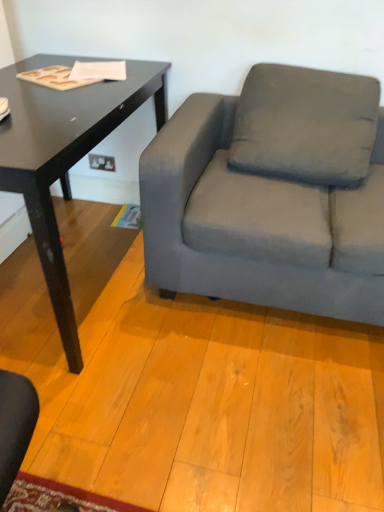
Locate an element on the screen. The height and width of the screenshot is (512, 384). gray fabric couch at right is located at coordinates (272, 195).

Image resolution: width=384 pixels, height=512 pixels. Describe the element at coordinates (64, 156) in the screenshot. I see `black glossy table at left` at that location.

Locate an element on the screen. The height and width of the screenshot is (512, 384). gray fabric couch at right is located at coordinates (272, 195).

You are a GUI agent. You are given a task and a screenshot of the screen. Output one action in this format:
    pyautogui.click(x=<x>, y=<y>)
    Task: Click on the table below the gray fabric pillow at center (from the image's perspective)
    Image resolution: width=384 pixels, height=512 pixels.
    Given the screenshot: What is the action you would take?
    pyautogui.click(x=64, y=156)

From the image's perspective, would you say gray fabric pillow at center is positioned over black glossy table at left?

Indeed, from the image's perspective, gray fabric pillow at center is shown above black glossy table at left.

Are gray fabric pillow at center and black glossy table at left beside each other?

No, gray fabric pillow at center is not with black glossy table at left.

Does gray fabric pillow at center have a greater width compared to black glossy table at left?

Incorrect, the width of gray fabric pillow at center does not surpass that of black glossy table at left.

Is gray fabric pillow at center inside gray fabric couch at right?

Indeed, gray fabric pillow at center is located within gray fabric couch at right.

Considering the relative sizes of gray fabric couch at right and gray fabric pillow at center in the image provided, is gray fabric couch at right thinner than gray fabric pillow at center?

Incorrect, the width of gray fabric couch at right is not less than that of gray fabric pillow at center.

Would you say gray fabric couch at right is to the left or to the right of gray fabric pillow at center in the picture?

gray fabric couch at right is to the left of gray fabric pillow at center.

Could you tell me if gray fabric couch at right is turned towards gray fabric pillow at center?

Yes, gray fabric couch at right is facing gray fabric pillow at center.

Image resolution: width=384 pixels, height=512 pixels. I want to click on table that appears on the left of gray fabric couch at right, so click(64, 156).

Based on the photo, considering the relative sizes of black glossy table at left and gray fabric couch at right in the image provided, is black glossy table at left bigger than gray fabric couch at right?

Incorrect, black glossy table at left is not larger than gray fabric couch at right.

Which object is further away from the camera taking this photo, black glossy table at left or gray fabric couch at right?

gray fabric couch at right is behind.

Is point (60, 154) closer to camera compared to point (323, 212)?

That is True.

Which object is further away from the camera, gray fabric couch at right or black glossy table at left?

gray fabric couch at right is behind.

From the picture: Are gray fabric couch at right and black glossy table at left making contact?

No, gray fabric couch at right is not touching black glossy table at left.

Is gray fabric couch at right oriented towards black glossy table at left?

No, gray fabric couch at right is not oriented towards black glossy table at left.

From the image's perspective, which object appears higher, gray fabric couch at right or black glossy table at left?

Answer: gray fabric couch at right appears higher in the image.

Can you confirm if black glossy table at left is shorter than gray fabric pillow at center?

No, black glossy table at left is not shorter than gray fabric pillow at center.

From a real-world perspective, between black glossy table at left and gray fabric pillow at center, who is vertically higher?

gray fabric pillow at center.

Consider the image. Could you tell me if black glossy table at left is turned towards gray fabric pillow at center?

Yes, black glossy table at left faces towards gray fabric pillow at center.

Measure the distance from gray fabric pillow at center to gray fabric couch at right.

gray fabric pillow at center is 5.53 inches from gray fabric couch at right.

Is there a large distance between gray fabric pillow at center and gray fabric couch at right?

That's not correct — gray fabric pillow at center is a little close to gray fabric couch at right.

Considering the relative positions of gray fabric pillow at center and gray fabric couch at right in the image provided, is gray fabric pillow at center behind gray fabric couch at right?

Yes, gray fabric pillow at center is further from the camera.

Where is `pillow behind the gray fabric couch at right`? pillow behind the gray fabric couch at right is located at coordinates (305, 125).

In order to click on table below the gray fabric pillow at center (from the image's perspective) in this screenshot , I will do `click(64, 156)`.

Identify the location of studio couch lying in front of the gray fabric pillow at center. (272, 195).

Looking at the image, which one is located further to gray fabric pillow at center, gray fabric couch at right or black glossy table at left?

black glossy table at left is positioned further to the anchor gray fabric pillow at center.

From the image, which object appears to be farther from gray fabric pillow at center, black glossy table at left or gray fabric couch at right?

black glossy table at left.

Based on their spatial positions, is gray fabric pillow at center or gray fabric couch at right further from black glossy table at left?

Among the two, gray fabric pillow at center is located further to black glossy table at left.

Based on their spatial positions, is gray fabric couch at right or gray fabric pillow at center further from black glossy table at left?

Among the two, gray fabric pillow at center is located further to black glossy table at left.

From the image, which object appears to be farther from gray fabric couch at right, black glossy table at left or gray fabric pillow at center?

Among the two, black glossy table at left is located further to gray fabric couch at right.

From the image, which object appears to be farther from gray fabric couch at right, gray fabric pillow at center or black glossy table at left?

black glossy table at left is positioned further to the anchor gray fabric couch at right.

At what (x,y) coordinates should I click in order to perform the action: click on studio couch situated between black glossy table at left and gray fabric pillow at center from left to right. Please return your answer as a coordinate pair (x, y). The height and width of the screenshot is (512, 384). Looking at the image, I should click on (272, 195).